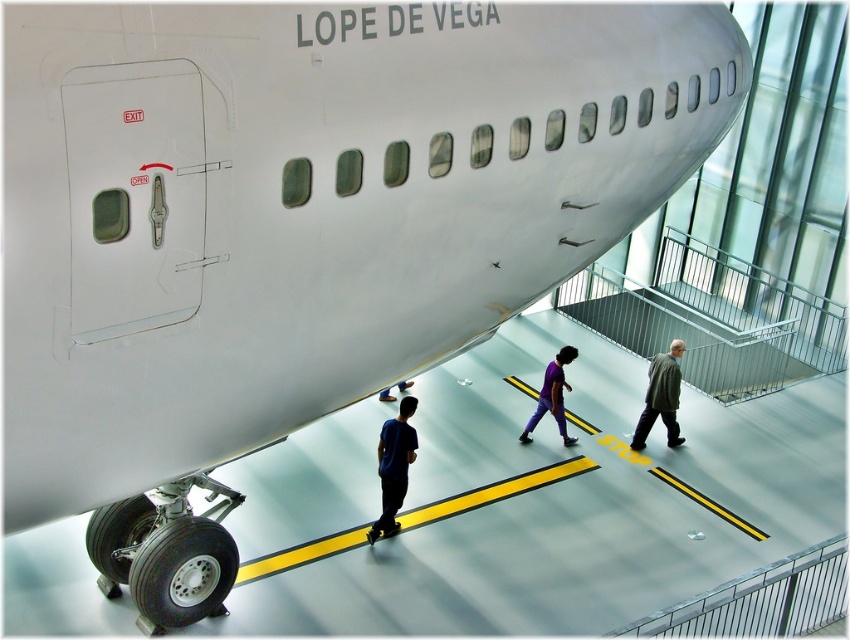
Between blue fabric shirt at center and green matte coat at center, which one is positioned higher?

green matte coat at center

Who is lower down, blue fabric shirt at center or green matte coat at center?

blue fabric shirt at center is below.

Is point (400, 422) farther from viewer compared to point (669, 438)?

No, it is not.

Image resolution: width=850 pixels, height=640 pixels. Find the location of `blue fabric shirt at center`. blue fabric shirt at center is located at coordinates (394, 467).

What do you see at coordinates (394, 467) in the screenshot? I see `blue fabric shirt at center` at bounding box center [394, 467].

Is blue fabric shirt at center smaller than blue fabric pants at center?

Incorrect, blue fabric shirt at center is not smaller in size than blue fabric pants at center.

Which is in front, point (388, 445) or point (406, 380)?

Point (388, 445) is in front.

Locate an element on the screen. The height and width of the screenshot is (640, 850). blue fabric shirt at center is located at coordinates point(394,467).

Does blue fabric shirt at center have a greater height compared to purple matte shirt at center?

Correct, blue fabric shirt at center is much taller as purple matte shirt at center.

Is blue fabric shirt at center positioned in front of purple matte shirt at center?

That is True.

Where is `blue fabric shirt at center`? The width and height of the screenshot is (850, 640). blue fabric shirt at center is located at coordinates (394, 467).